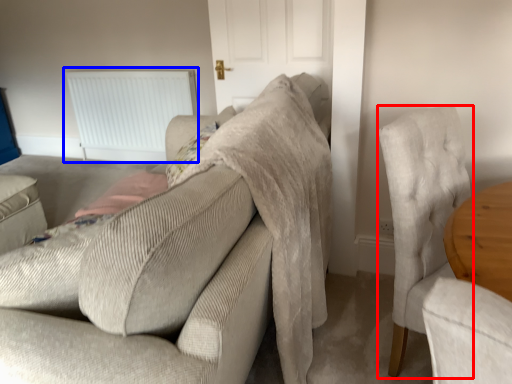
Question: Among these objects, which one is nearest to the camera, chair (highlighted by a red box) or radiator (highlighted by a blue box)?

Choices:
 (A) chair
 (B) radiator

Answer: (A)